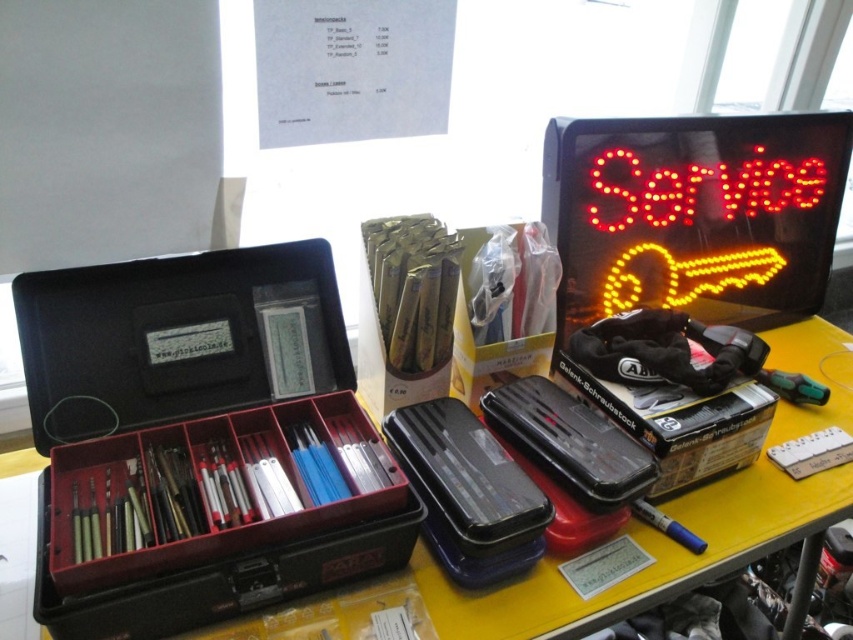
Can you confirm if black plastic toolbox at center is positioned below yellow matte table at center?

No.

Is point (204, 307) less distant than point (491, 602)?

No, it is not.

Is point (57, 394) positioned after point (834, 476)?

No, (57, 394) is in front of (834, 476).

Image resolution: width=853 pixels, height=640 pixels. In order to click on black plastic toolbox at center in this screenshot , I will do `click(196, 440)`.